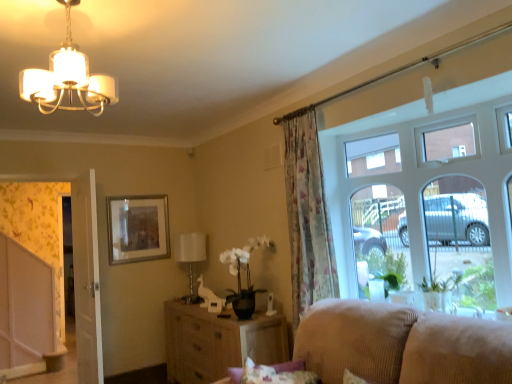
What do you see at coordinates (190, 256) in the screenshot? I see `white fabric lampshade at center, arranged as the 1th lamp when ordered from the bottom` at bounding box center [190, 256].

Find the location of `white wooden door at left`. white wooden door at left is located at coordinates coord(86,279).

This screenshot has width=512, height=384. I want to click on clear glass window at right, so coord(431,196).

This screenshot has width=512, height=384. What do you see at coordinates (137, 228) in the screenshot? I see `silver metallic picture frame at upper center` at bounding box center [137, 228].

Find the location of a particular element. woven wood cabinet at center is located at coordinates (218, 342).

What do you see at coordinates (218, 342) in the screenshot? The width and height of the screenshot is (512, 384). I see `woven wood cabinet at center` at bounding box center [218, 342].

The height and width of the screenshot is (384, 512). Identify the location of white fabric lampshade at center, which appears as the 2th lamp when viewed from the top. (190, 256).

Does beige corduroy couch at lower right have a greater height compared to clear glass window at right?

No, beige corduroy couch at lower right is not taller than clear glass window at right.

Is beige corduroy couch at lower right not near clear glass window at right?

That's not correct — beige corduroy couch at lower right is a little close to clear glass window at right.

Is the position of beige corduroy couch at lower right more distant than that of clear glass window at right?

No, beige corduroy couch at lower right is closer to the camera.

How different are the orientations of matte white chandelier at upper left, which is the 2th lamp from bottom to top, and clear glass window at right in degrees?

matte white chandelier at upper left, which is the 2th lamp from bottom to top, and clear glass window at right are facing 89.8 degrees away from each other.

From the image's perspective, which object appears higher, matte white chandelier at upper left, which is the 2th lamp from bottom to top, or clear glass window at right?

matte white chandelier at upper left, which is the 2th lamp from bottom to top, is shown above in the image.

Considering the sizes of matte white chandelier at upper left, the 1th lamp when ordered from front to back, and clear glass window at right in the image, is matte white chandelier at upper left, the 1th lamp when ordered from front to back, wider or thinner than clear glass window at right?

Considering their sizes, matte white chandelier at upper left, the 1th lamp when ordered from front to back, looks slimmer than clear glass window at right.

Considering the sizes of floral fabric curtain at center and beige corduroy couch at lower right in the image, is floral fabric curtain at center bigger or smaller than beige corduroy couch at lower right?

Clearly, floral fabric curtain at center is smaller in size than beige corduroy couch at lower right.

From the image's perspective, between floral fabric curtain at center and beige corduroy couch at lower right, which one is located above?

floral fabric curtain at center, from the image's perspective.

You are a GUI agent. You are given a task and a screenshot of the screen. Output one action in this format:
    pyautogui.click(x=<x>, y=<y>)
    Task: Click on the studio couch below the floral fabric curtain at center (from a real-world perspective)
    The width and height of the screenshot is (512, 384).
    Given the screenshot: What is the action you would take?
    pyautogui.click(x=401, y=344)

Which is in front, point (52, 77) or point (371, 372)?

Positioned in front is point (371, 372).

From the image's perspective, is matte white chandelier at upper left, the first lamp viewed from the top, positioned above or below beige corduroy couch at lower right?

Clearly, from the image's perspective, matte white chandelier at upper left, the first lamp viewed from the top, is above beige corduroy couch at lower right.

Does matte white chandelier at upper left, the 1th lamp when ordered from front to back, contain beige corduroy couch at lower right?

Actually, beige corduroy couch at lower right is outside matte white chandelier at upper left, the 1th lamp when ordered from front to back.

From the beige corduroy couch at lower right, count 1st lamps backward and point to it. Please provide its 2D coordinates.

[(68, 79)]

Which is behind, point (44, 275) or point (92, 169)?

Positioned behind is point (44, 275).

Who is taller, white glossy screen door at left or white wooden door at left?

Standing taller between the two is white glossy screen door at left.

From the image's perspective, which is above, white glossy screen door at left or white wooden door at left?

white wooden door at left, from the image's perspective.

From a real-world perspective, which object stands above the other?

white glossy screen door at left, from a real-world perspective.

Is the position of matte white chandelier at upper left, the 2th lamp in the back-to-front sequence, less distant than that of white glossy screen door at left?

Yes.

Could you tell me if matte white chandelier at upper left, which is the 2th lamp from bottom to top, is turned towards white glossy screen door at left?

Yes.

Looking at their sizes, would you say matte white chandelier at upper left, the 1th lamp when ordered from front to back, is wider or thinner than white glossy screen door at left?

matte white chandelier at upper left, the 1th lamp when ordered from front to back, is wider than white glossy screen door at left.

From the picture: From the image's perspective, is matte white chandelier at upper left, which is the 2th lamp from bottom to top, on top of white glossy screen door at left?

Indeed, from the image's perspective, matte white chandelier at upper left, which is the 2th lamp from bottom to top, is shown above white glossy screen door at left.

Which object is positioned more to the right, woven wood cabinet at center or silver metallic picture frame at upper center?

Positioned to the right is woven wood cabinet at center.

Locate an element on the screen. The width and height of the screenshot is (512, 384). cabinetry in front of the silver metallic picture frame at upper center is located at coordinates (218, 342).

Does woven wood cabinet at center have a greater width compared to silver metallic picture frame at upper center?

Yes, woven wood cabinet at center is wider than silver metallic picture frame at upper center.

From a real-world perspective, which object stands above the other?

silver metallic picture frame at upper center, from a real-world perspective.

Where is `studio couch below the clear glass window at right (from the image's perspective)`? This screenshot has width=512, height=384. studio couch below the clear glass window at right (from the image's perspective) is located at coordinates (401, 344).

Locate an element on the screen. lamp lying in front of the clear glass window at right is located at coordinates (68, 79).

Based on their spatial positions, is white glossy screen door at left or woven wood cabinet at center further from clear glass window at right?

white glossy screen door at left is positioned further to the anchor clear glass window at right.

Consider the image. Estimate the real-world distances between objects in this image. Which object is closer to white fabric lampshade at center, placed as the 2th lamp when sorted from front to back, white glossy screen door at left or clear glass window at right?

white glossy screen door at left.

Based on their spatial positions, is white fabric lampshade at center, arranged as the 1th lamp when ordered from the bottom, or silver metallic picture frame at upper center further from beige corduroy couch at lower right?

Among the two, silver metallic picture frame at upper center is located further to beige corduroy couch at lower right.

Which object lies nearer to the anchor point white wooden door at left, woven wood cabinet at center or white fabric lampshade at center, which appears as the 2th lamp when viewed from the top?

woven wood cabinet at center is positioned closer to the anchor white wooden door at left.

In the scene shown: Which object lies nearer to the anchor point white glossy screen door at left, matte white chandelier at upper left, the 1th lamp when ordered from front to back, or woven wood cabinet at center?

woven wood cabinet at center lies closer to white glossy screen door at left than the other object.

Estimate the real-world distances between objects in this image. Which object is closer to beige corduroy couch at lower right, white wooden door at left or white glossy screen door at left?

white wooden door at left is closer to beige corduroy couch at lower right.

When comparing their distances from silver metallic picture frame at upper center, does floral fabric curtain at center or beige corduroy couch at lower right seem further?

Based on the image, beige corduroy couch at lower right appears to be further to silver metallic picture frame at upper center.

Estimate the real-world distances between objects in this image. Which object is further from white wooden door at left, silver metallic picture frame at upper center or woven wood cabinet at center?

Based on the image, woven wood cabinet at center appears to be further to white wooden door at left.

What are the coordinates of `window positioned between matte white chandelier at upper left, the 2th lamp in the back-to-front sequence, and silver metallic picture frame at upper center from near to far` in the screenshot? It's located at (431, 196).

The image size is (512, 384). Find the location of `curtain located between beige corduroy couch at lower right and white fabric lampshade at center, which appears as the 2th lamp when viewed from the top, in the depth direction`. curtain located between beige corduroy couch at lower right and white fabric lampshade at center, which appears as the 2th lamp when viewed from the top, in the depth direction is located at coordinates (307, 214).

Where is `cabinetry between beige corduroy couch at lower right and white fabric lampshade at center, arranged as the 1th lamp when ordered from the bottom, in the front-back direction`? The image size is (512, 384). cabinetry between beige corduroy couch at lower right and white fabric lampshade at center, arranged as the 1th lamp when ordered from the bottom, in the front-back direction is located at coordinates (218, 342).

Locate an element on the screen. studio couch between matte white chandelier at upper left, which is the 2th lamp from bottom to top, and clear glass window at right is located at coordinates (401, 344).